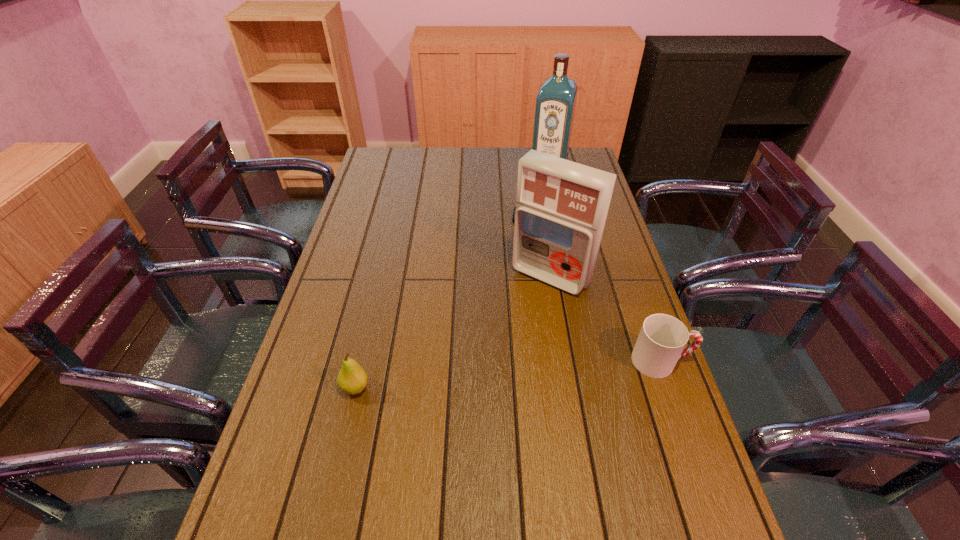
Where is `vacant area that lies between the leftmost object and the shortest object`? This screenshot has height=540, width=960. vacant area that lies between the leftmost object and the shortest object is located at coordinates (443, 303).

Locate an element on the screen. The height and width of the screenshot is (540, 960). unoccupied position between the shortest object and the leftmost object is located at coordinates (443, 303).

Identify the location of free point between the shortest object and the cup. (596, 290).

Identify which object is the nearest to the shortest object. Please provide its 2D coordinates. Your answer should be formatted as a tuple, i.e. [(x, y)], where the tuple contains the x and y coordinates of a point satisfying the conditions above.

[(561, 206)]

The height and width of the screenshot is (540, 960). What are the coordinates of `object that stands as the second closest to the cup` in the screenshot? It's located at (513, 217).

The width and height of the screenshot is (960, 540). I want to click on free space that satisfies the following two spatial constraints: 1. on the front side of the alarm clock; 2. on the side of the cup where the handle is located, so click(x=549, y=361).

You are a GUI agent. You are given a task and a screenshot of the screen. Output one action in this format:
    pyautogui.click(x=<x>, y=<y>)
    Task: Click on the vacant space that satisfies the following two spatial constraints: 1. on the front side of the rightmost object; 2. on the side of the liquor where the handle is located
    The width and height of the screenshot is (960, 540).
    Given the screenshot: What is the action you would take?
    pyautogui.click(x=590, y=361)

Locate an element on the screen. This screenshot has width=960, height=540. free space that satisfies the following two spatial constraints: 1. on the front side of the third nearest object; 2. on the left side of the alarm clock is located at coordinates (538, 276).

The image size is (960, 540). I want to click on free space that satisfies the following two spatial constraints: 1. on the front side of the first-aid kit; 2. on the side of the cup where the handle is located, so click(564, 361).

This screenshot has width=960, height=540. In order to click on vacant space that satisfies the following two spatial constraints: 1. on the back side of the fourth shortest object; 2. on the left side of the pear in this screenshot , I will do `click(381, 276)`.